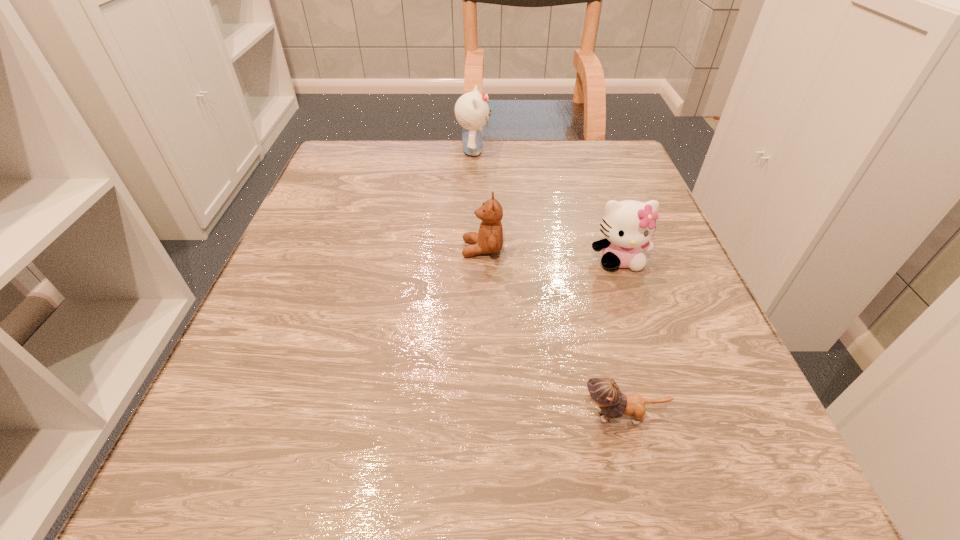
In the image, there is a desktop. Where is `vacant region at the near right corner`? The height and width of the screenshot is (540, 960). vacant region at the near right corner is located at coordinates (720, 511).

Where is `free space between the farthest object and the shortest kitten`? This screenshot has height=540, width=960. free space between the farthest object and the shortest kitten is located at coordinates (547, 284).

Locate an element on the screen. This screenshot has height=540, width=960. free point between the second farthest kitten and the farthest kitten is located at coordinates (546, 205).

I want to click on vacant area between the teddy bear and the shortest kitten, so click(x=552, y=333).

The image size is (960, 540). I want to click on blank region between the teddy bear and the second tallest kitten, so click(x=551, y=254).

Identify the location of blank region between the second tallest kitten and the farthest object. The width and height of the screenshot is (960, 540). (546, 205).

This screenshot has height=540, width=960. Identify the location of unoccupied area between the teddy bear and the nearest object. (552, 333).

You are a GUI agent. You are given a task and a screenshot of the screen. Output one action in this format:
    pyautogui.click(x=<x>, y=<y>)
    Task: Click on the vacant space that's between the nearest object and the second shortest kitten
    Image resolution: width=960 pixels, height=540 pixels.
    Given the screenshot: What is the action you would take?
    pyautogui.click(x=620, y=338)

You are a GUI agent. You are given a task and a screenshot of the screen. Output one action in this format:
    pyautogui.click(x=<x>, y=<y>)
    Task: Click on the empty location between the leftmost kitten and the second shortest kitten
    This screenshot has height=540, width=960.
    Given the screenshot: What is the action you would take?
    pyautogui.click(x=546, y=205)

Find the location of a particular element. The height and width of the screenshot is (540, 960). vacant area that lies between the teddy bear and the shortest kitten is located at coordinates (552, 333).